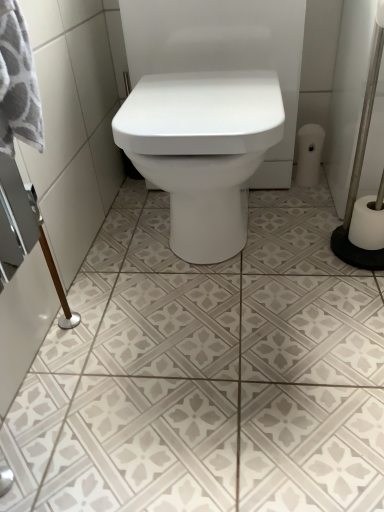
Locate an element on the screen. The image size is (384, 512). free space that is in between white matte toilet paper at right, marked as the second toilet paper in a right-to-left arrangement, and white matte toilet paper at right, the second toilet paper from the top is located at coordinates (322, 205).